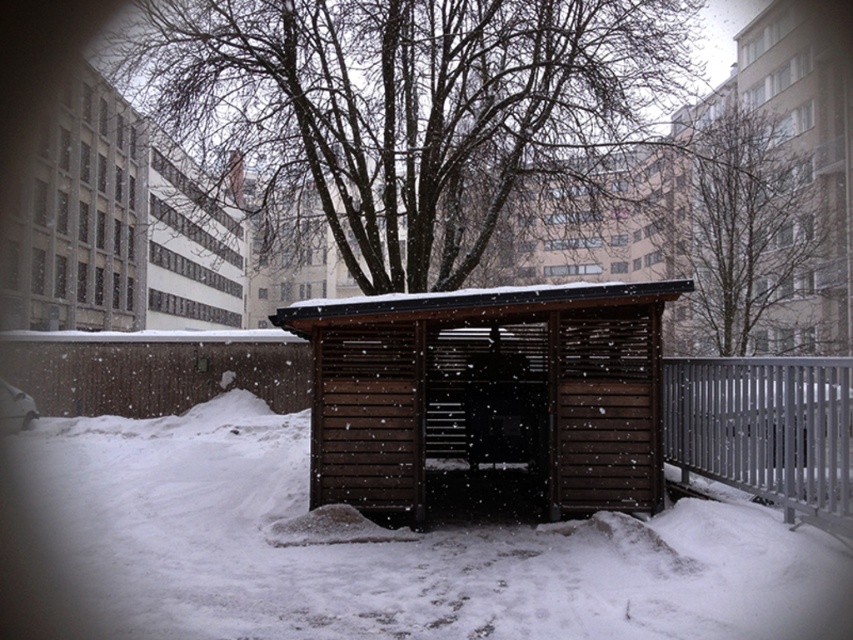
Consider the image. You are a delivery person trying to navigate through the snow. You see the bare branches at upper center and the silver metallic fence at right. Which object is taller?

The bare branches at upper center are taller than the silver metallic fence at right.

You are standing at the bus stop and want to take a photo of the bare branches at upper center. Where should you position yourself to capture the branches in the upper center of your camera viewfinder?

You should position yourself directly in front of the bus stop structure since the bare branches at upper center are located at coordinates point (744, 230), which places them in the upper central area of the scene.

You are a delivery person trying to navigate through the snowy area. You see the white fluffy snow at center and the bare branches at upper center. Which one is lower in the scene?

The white fluffy snow at center is located below the bare branches at upper center, so the white fluffy snow at center is lower in the scene.